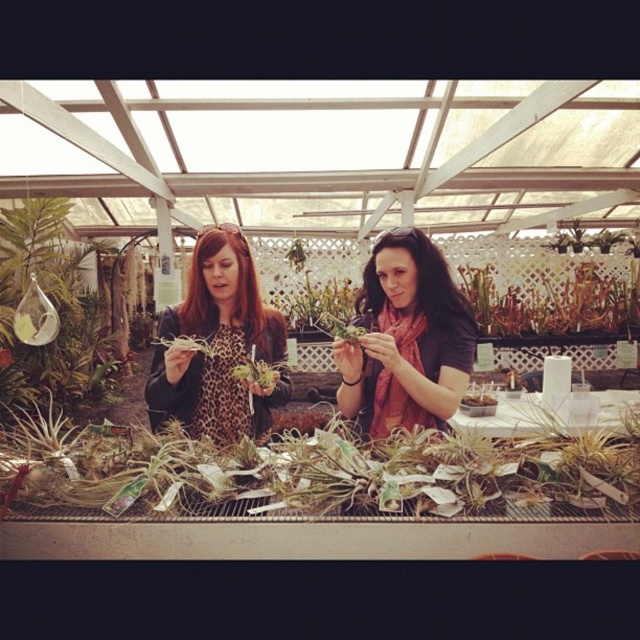
You are a customer in a greenhouse and see the green leafy plant at center and the leopard print jacket at center. Which object is bigger?

The green leafy plant at center is larger in size compared to the leopard print jacket at center.

You are a customer in the greenhouse and want to buy both the matte black scarf at center and the leopard print jacket at center. The store has a discount for items that are smaller than others. Which item qualifies for the discount?

The matte black scarf at center qualifies for the discount because it has a smaller size compared to the leopard print jacket at center.